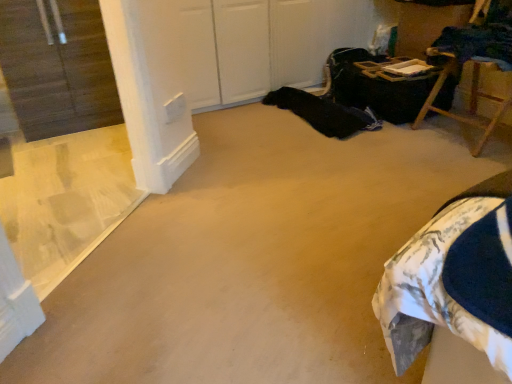
This screenshot has width=512, height=384. In order to click on vacant area in front of transparent plastic window at left in this screenshot , I will do `click(122, 329)`.